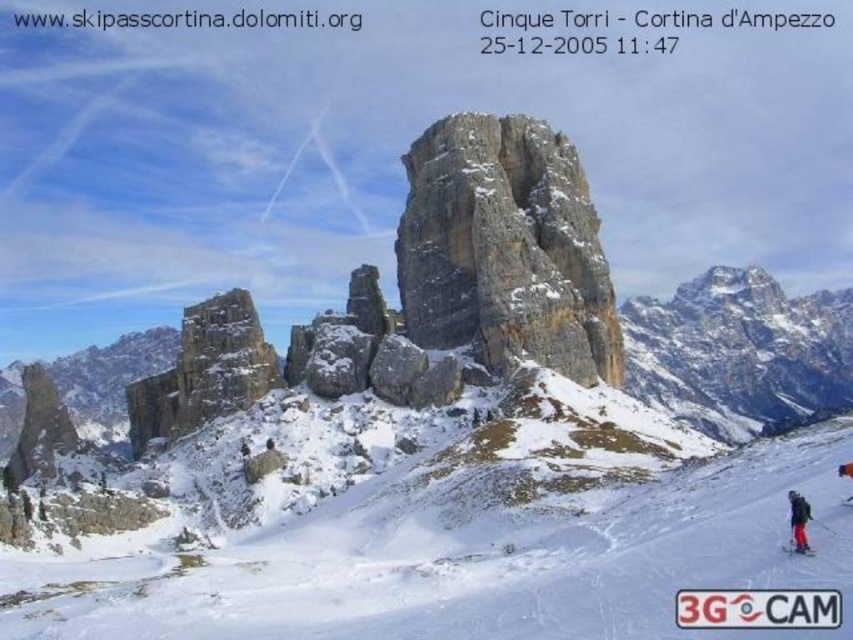
Question: Which is nearer to the orange ski suit at lower right?

Choices:
 (A) gray rocky cliff at center
 (B) red matte ski at lower right

Answer: (B)

Question: Considering the real-world distances, which object is farthest from the red matte ski at lower right?

Choices:
 (A) white plastic ski at lower right
 (B) black ski suit at lower right
 (C) white snow at center

Answer: (C)

Question: Does white snow at center have a lesser width compared to red matte ski at lower right?

Choices:
 (A) no
 (B) yes

Answer: (A)

Question: Which of the following is the farthest from the observer?

Choices:
 (A) (848, 497)
 (B) (367, 611)

Answer: (B)

Question: In this image, where is gray rocky cliff at center located relative to black ski suit at lower right?

Choices:
 (A) right
 (B) left

Answer: (B)

Question: From the image, what is the correct spatial relationship of white snow at center in relation to gray rocky cliff at center?

Choices:
 (A) above
 (B) below

Answer: (B)